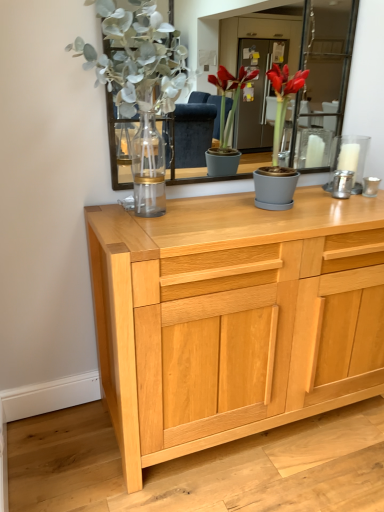
This screenshot has width=384, height=512. I want to click on matte glass vase at upper left, so click(137, 70).

What is the approximate width of silver metallic candle holder at right?

silver metallic candle holder at right is 3.45 inches in width.

What do you see at coordinates (348, 159) in the screenshot? The height and width of the screenshot is (512, 384). I see `silver metallic candle holder at right` at bounding box center [348, 159].

Identify the location of matte gray pot at center. Image resolution: width=384 pixels, height=512 pixels. (278, 147).

From a real-world perspective, is matte gray pot at center above or below matte glass vase at upper left?

In terms of real-world spatial position, matte gray pot at center is below matte glass vase at upper left.

Considering the positions of points (286, 69) and (152, 61), is point (286, 69) farther from camera compared to point (152, 61)?

Yes.

Is matte gray pot at center wider or thinner than matte glass vase at upper left?

matte gray pot at center is thinner than matte glass vase at upper left.

In terms of size, does silver metallic candle holder at right appear bigger or smaller than matte glass vase at upper left?

In the image, silver metallic candle holder at right appears to be smaller than matte glass vase at upper left.

Which of these two, silver metallic candle holder at right or matte glass vase at upper left, is wider?

With larger width is matte glass vase at upper left.

Can you confirm if silver metallic candle holder at right is shorter than matte glass vase at upper left?

Yes.

What's the angular difference between silver metallic candle holder at right and matte glass vase at upper left's facing directions?

The angle between the facing direction of silver metallic candle holder at right and the facing direction of matte glass vase at upper left is 0.723 degrees.

Between matte glass vase at upper left and matte gray pot at center, which one has smaller size?

matte gray pot at center is smaller.

Does matte glass vase at upper left turn towards matte gray pot at center?

No.

Locate an element on the screen. The image size is (384, 512). houseplant lying below the matte glass vase at upper left (from the image's perspective) is located at coordinates (278, 147).

Can you confirm if matte glass vase at upper left is positioned to the left of matte gray pot at center?

Yes.

Looking at this image, from a real-world perspective, between matte glass vase at upper left and light wood cabinet at center, who is vertically lower?

light wood cabinet at center.

From the image's perspective, is matte glass vase at upper left under light wood cabinet at center?

No, from the image's perspective, matte glass vase at upper left is not below light wood cabinet at center.

Is matte glass vase at upper left situated inside light wood cabinet at center or outside?

matte glass vase at upper left is not inside light wood cabinet at center, it's outside.

Which of these two, matte glass vase at upper left or light wood cabinet at center, is smaller?

matte glass vase at upper left is smaller.

Where is `candle holder lying on the right of light wood cabinet at center`? The image size is (384, 512). candle holder lying on the right of light wood cabinet at center is located at coordinates (348, 159).

Would you say light wood cabinet at center contains silver metallic candle holder at right?

No, silver metallic candle holder at right is not surrounded by light wood cabinet at center.

Does light wood cabinet at center have a larger size compared to silver metallic candle holder at right?

Yes.

Is matte gray pot at center thinner than silver metallic candle holder at right?

Incorrect, the width of matte gray pot at center is not less than that of silver metallic candle holder at right.

In terms of size, does matte gray pot at center appear bigger or smaller than silver metallic candle holder at right?

In the image, matte gray pot at center appears to be larger than silver metallic candle holder at right.

Is matte gray pot at center turned away from silver metallic candle holder at right?

No, matte gray pot at center's orientation is not away from silver metallic candle holder at right.

Considering the sizes of objects matte gray pot at center and silver metallic candle holder at right in the image provided, who is shorter, matte gray pot at center or silver metallic candle holder at right?

Standing shorter between the two is silver metallic candle holder at right.

Looking at this image, how different are the orientations of matte gray pot at center and light wood cabinet at center in degrees?

The angle between the facing direction of matte gray pot at center and the facing direction of light wood cabinet at center is 1.15 degrees.

The width and height of the screenshot is (384, 512). Identify the location of chest of drawers below the matte gray pot at center (from a real-world perspective). (234, 318).

Is the depth of matte gray pot at center greater than that of light wood cabinet at center?

That is True.

Find the location of a particular element. The image size is (384, 512). floral arrangement above the matte gray pot at center (from the image's perspective) is located at coordinates click(137, 70).

Where is `floral arrangement lying in front of the silver metallic candle holder at right`? The image size is (384, 512). floral arrangement lying in front of the silver metallic candle holder at right is located at coordinates (137, 70).

From the image, which object appears to be farther from light wood cabinet at center, silver metallic candle holder at right or matte glass vase at upper left?

silver metallic candle holder at right is positioned further to the anchor light wood cabinet at center.

When comparing their distances from silver metallic candle holder at right, does matte glass vase at upper left or light wood cabinet at center seem closer?

The object closer to silver metallic candle holder at right is light wood cabinet at center.

Based on their spatial positions, is silver metallic candle holder at right or matte gray pot at center further from matte glass vase at upper left?

silver metallic candle holder at right is positioned further to the anchor matte glass vase at upper left.

Considering their positions, is matte gray pot at center positioned closer to matte glass vase at upper left than light wood cabinet at center?

matte gray pot at center is closer to matte glass vase at upper left.

Considering their positions, is silver metallic candle holder at right positioned further to matte gray pot at center than light wood cabinet at center?

light wood cabinet at center lies further to matte gray pot at center than the other object.

Which object lies nearer to the anchor point silver metallic candle holder at right, matte gray pot at center or light wood cabinet at center?

matte gray pot at center.

Based on their spatial positions, is matte glass vase at upper left or matte gray pot at center closer to light wood cabinet at center?

matte gray pot at center.

Which object lies further to the anchor point matte glass vase at upper left, matte gray pot at center or silver metallic candle holder at right?

silver metallic candle holder at right is further to matte glass vase at upper left.

At what (x,y) coordinates should I click in order to perform the action: click on candle holder between matte gray pot at center and light wood cabinet at center vertically. Please return your answer as a coordinate pair (x, y). The width and height of the screenshot is (384, 512). Looking at the image, I should click on (348, 159).

Find the location of a particular element. The image size is (384, 512). houseplant between matte glass vase at upper left and light wood cabinet at center from top to bottom is located at coordinates tap(278, 147).

Where is `chest of drawers between matte glass vase at upper left and silver metallic candle holder at right`? chest of drawers between matte glass vase at upper left and silver metallic candle holder at right is located at coordinates (234, 318).

At what (x,y) coordinates should I click in order to perform the action: click on houseplant between matte glass vase at upper left and silver metallic candle holder at right in the horizontal direction. Please return your answer as a coordinate pair (x, y). The width and height of the screenshot is (384, 512). Looking at the image, I should click on (278, 147).